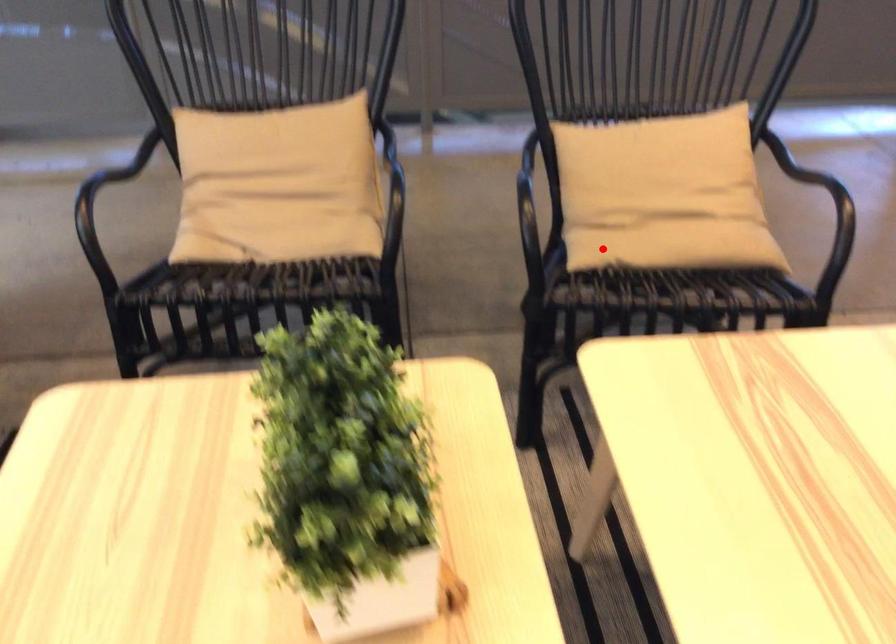
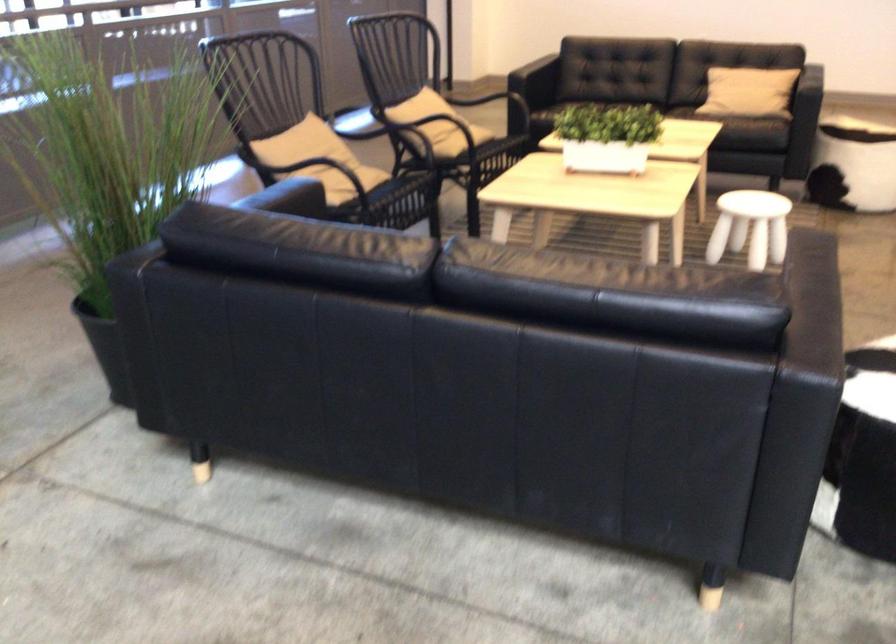
Question: I am providing you with two images of the same scene from different viewpoints. Image1 has a red point marked. In image2, the corresponding 3D location appears at what relative position? Reply with the corresponding letter.

Choices:
 (A) Closer
 (B) Farther

Answer: (B)